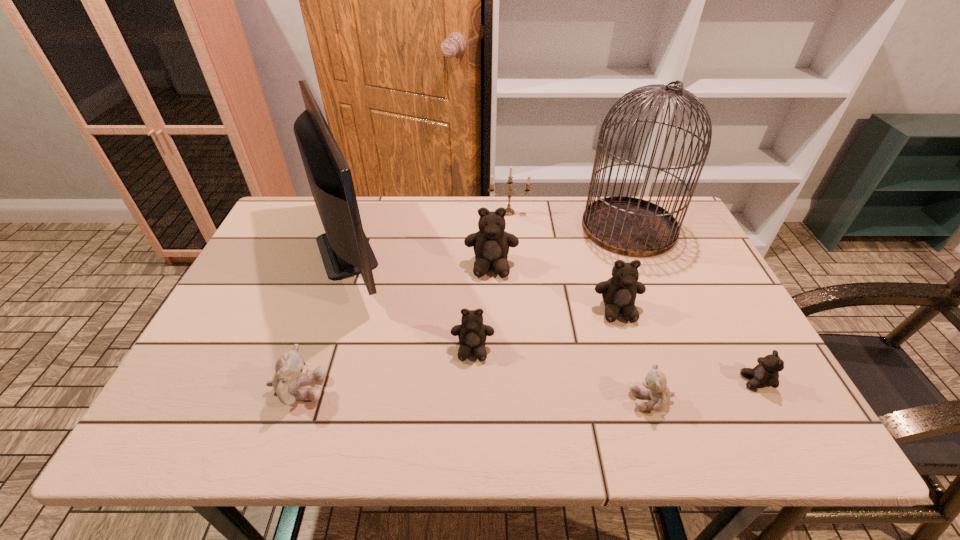
Locate an element on the screen. The image size is (960, 540). the bigger gray teddy bear is located at coordinates (291, 372).

Image resolution: width=960 pixels, height=540 pixels. What are the coordinates of `the rightmost teddy bear` in the screenshot? It's located at (765, 374).

Locate an element on the screen. This screenshot has height=540, width=960. the rightmost brown teddy bear is located at coordinates (765, 374).

Locate an element on the screen. the smaller gray teddy bear is located at coordinates (655, 383).

The image size is (960, 540). I want to click on vacant region located 0.340m on the left of the birdcage, so click(472, 228).

Where is `blank space located on the front-facing side of the computer monitor`? The width and height of the screenshot is (960, 540). blank space located on the front-facing side of the computer monitor is located at coordinates (432, 251).

Where is `vacant space located on the face of the farthest teddy bear`? The width and height of the screenshot is (960, 540). vacant space located on the face of the farthest teddy bear is located at coordinates (492, 308).

Find the location of a particular element. vacant space located on the right of the metallic candle is located at coordinates (582, 213).

In order to click on free spot located 0.150m on the face of the second farthest brown teddy bear in this screenshot , I will do `click(638, 377)`.

The height and width of the screenshot is (540, 960). In order to click on free space located 0.170m on the face of the third biggest brown teddy bear in this screenshot , I will do `click(471, 435)`.